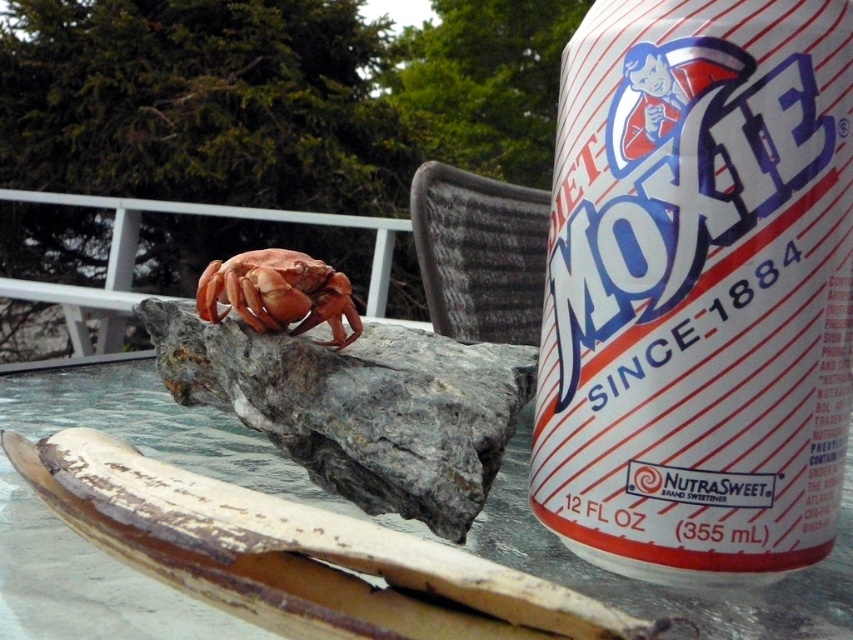
Is white paper can at upper right closer to camera compared to smooth orange crab at center?

Yes, it is in front of smooth orange crab at center.

Which is more to the left, white paper can at upper right or smooth orange crab at center?

From the viewer's perspective, smooth orange crab at center appears more on the left side.

Looking at this image, who is more forward, (718, 65) or (328, 317)?

Point (718, 65) is in front.

This screenshot has width=853, height=640. Find the location of `white paper can at upper right`. white paper can at upper right is located at coordinates (698, 289).